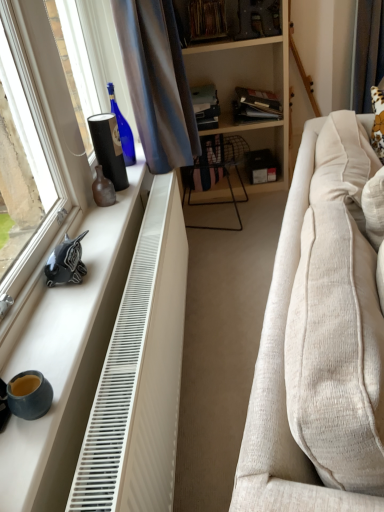
Question: Looking at their shapes, would you say brown fabric curtain at upper right, acting as the second curtain starting from the front, is wider or thinner than satin blue curtain at upper left, which is the first curtain in front-to-back order?

Choices:
 (A) wide
 (B) thin

Answer: (B)

Question: Considering the relative positions of brown fabric curtain at upper right, acting as the second curtain starting from the front, and satin blue curtain at upper left, which ranks as the 1th curtain in left-to-right order, in the image provided, is brown fabric curtain at upper right, acting as the second curtain starting from the front, to the left or to the right of satin blue curtain at upper left, which ranks as the 1th curtain in left-to-right order,?

Choices:
 (A) right
 (B) left

Answer: (A)

Question: Which of these objects is positioned farthest from the hardcover book at upper center, the 2th book positioned from the right?

Choices:
 (A) black glossy unicorn at left
 (B) white plastic radiator at lower left
 (C) satin blue curtain at upper left, the second curtain viewed from the right
 (D) matte black folder at upper center, positioned as the 3th book in left-to-right order
 (E) beige fabric couch at right

Answer: (A)

Question: Which object is the closest to the brown matte vase at left?

Choices:
 (A) white plastic radiator at lower left
 (B) hardcover book at upper center, the second book positioned from the left
 (C) black glossy unicorn at left
 (D) hardcover book at center, which is counted as the 3th book, starting from the right
 (E) white matte window sill at left

Answer: (C)